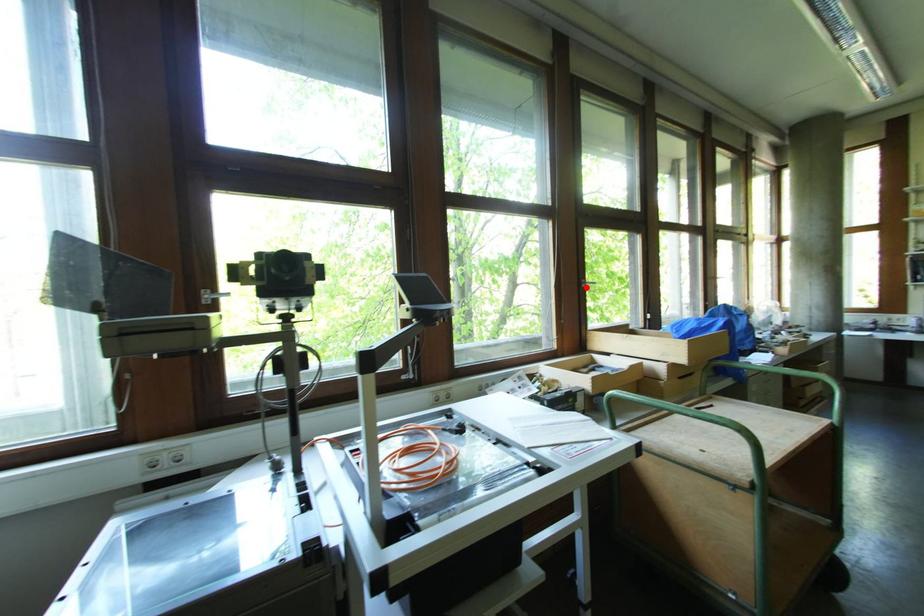
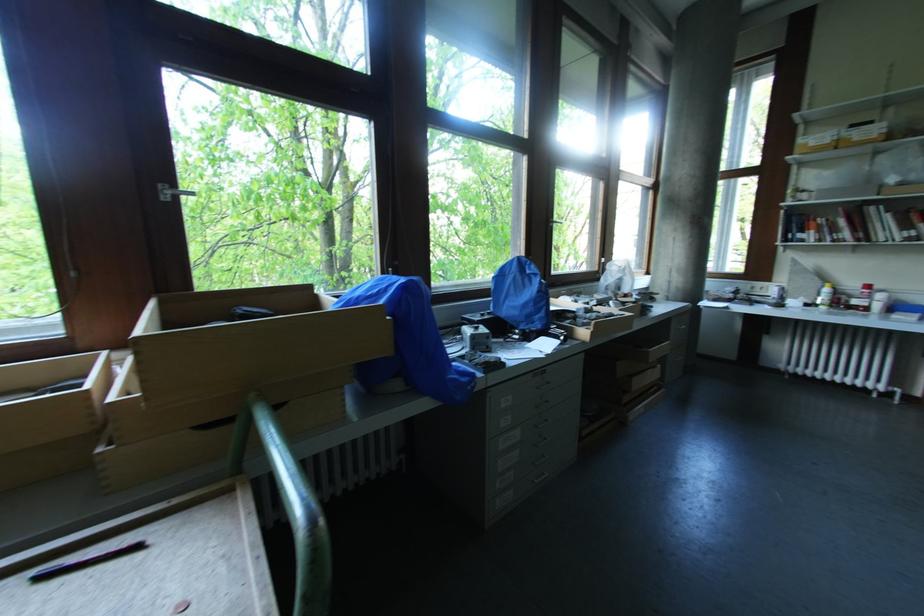
The point at the highlighted location is marked in the first image. Where is the corresponding point in the second image?

(167, 199)